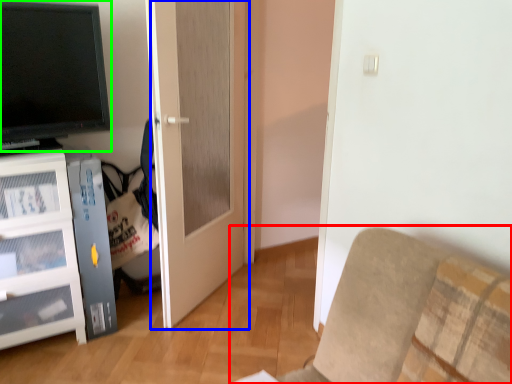
Question: Based on their relative distances, which object is nearer to furniture (highlighted by a red box)? Choose from door (highlighted by a blue box) and television (highlighted by a green box).

Choices:
 (A) door
 (B) television

Answer: (A)